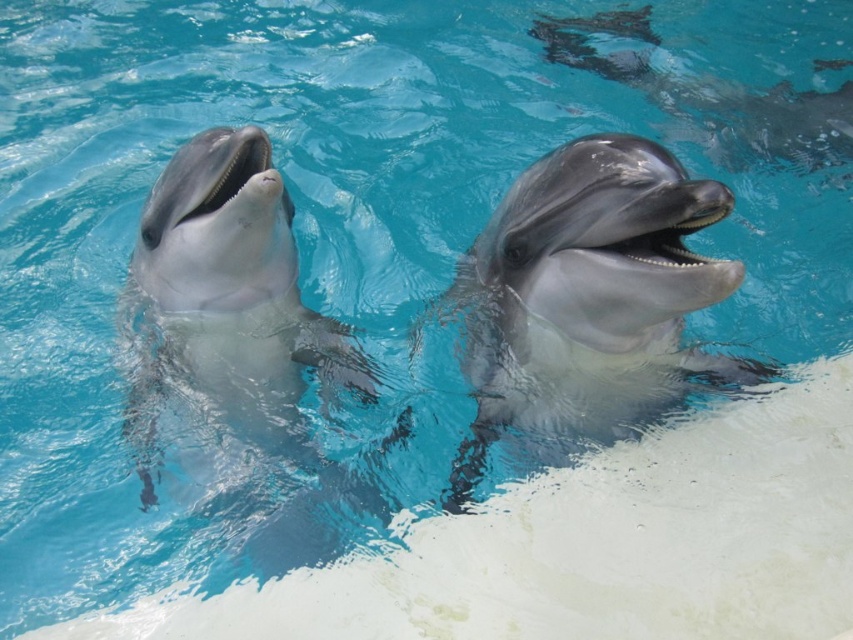
You are a marine biologist observing dolphins in a pool. You notice the smooth gray dolphin at center. Can you determine its exact coordinates in the pool?

The smooth gray dolphin at center is located at coordinates point (233, 308).

You are a marine biologist observing two dolphins in a pool. You see the sleek gray dolphin at center and the smooth gray dolphin at center. Which dolphin do you think has a larger width?

The sleek gray dolphin at center might be wider than smooth gray dolphin at center according to the description.